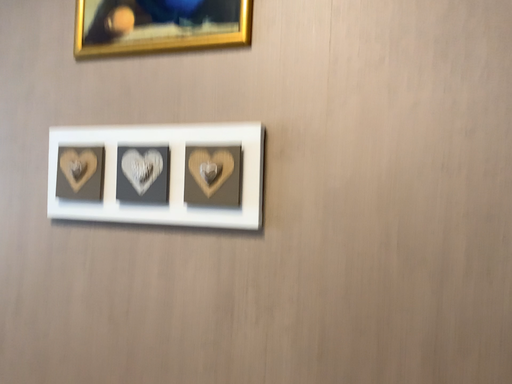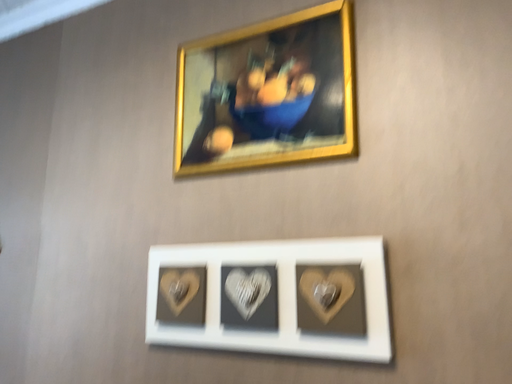
Question: How did the camera likely rotate when shooting the video?

Choices:
 (A) rotated right
 (B) rotated left

Answer: (B)